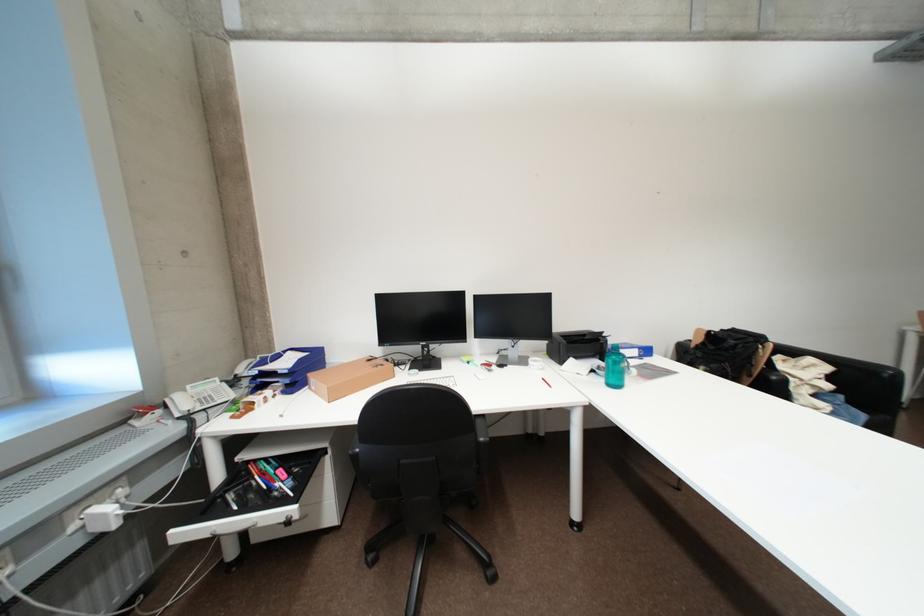
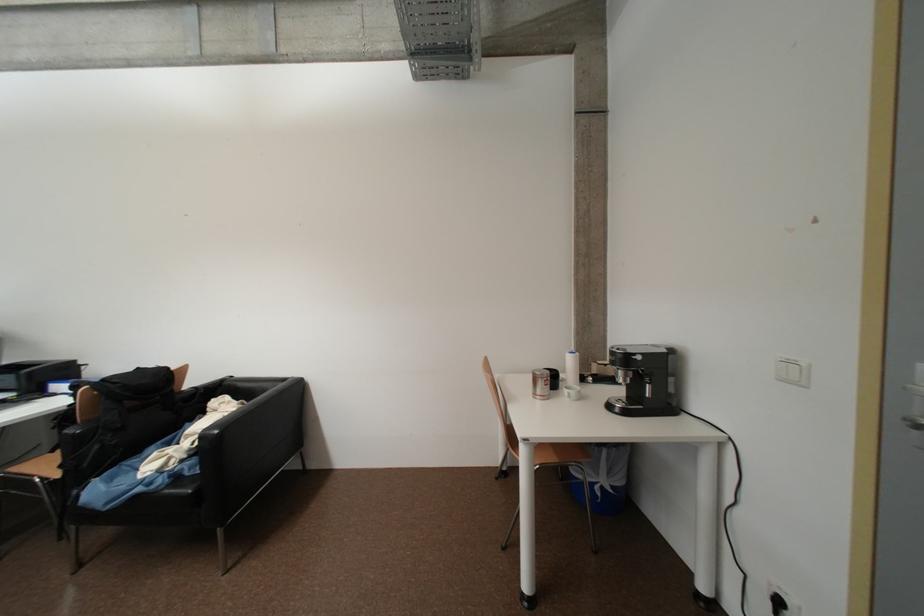
Question: In a continuous first-person perspective shot, in which direction is the camera moving?

Choices:
 (A) Left
 (B) Right
 (C) Forward
 (D) Backward

Answer: (B)